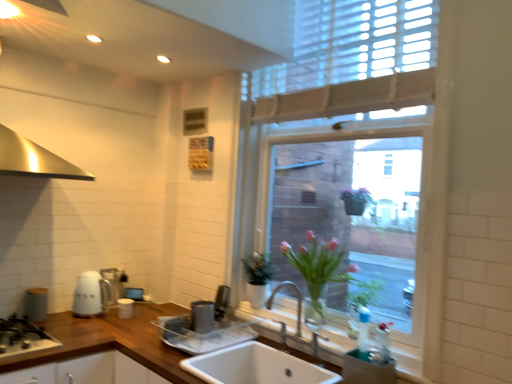
Describe the element at coordinates (256, 366) in the screenshot. I see `white ceramic sink at center` at that location.

Measure the distance between point [222,363] and camera.

The depth of point [222,363] is 6.42 feet.

Describe the element at coordinates (36, 304) in the screenshot. I see `matte gray canister at left, the third appliance positioned from the back` at that location.

Measure the distance between point (42, 310) and camera.

Point (42, 310) and camera are 2.35 meters apart from each other.

Consider the image. What is the approximate width of white glossy kettle at lower left, the 4th appliance from the right?

white glossy kettle at lower left, the 4th appliance from the right, is 6.95 inches wide.

The width and height of the screenshot is (512, 384). Identify the location of pink glass vase at center. (318, 266).

You are a GUI agent. You are given a task and a screenshot of the screen. Output one action in this format:
    pyautogui.click(x=<x>, y=<y>)
    Task: Click on the white ceramic sink at center
    The height and width of the screenshot is (384, 512).
    Given the screenshot: What is the action you would take?
    pyautogui.click(x=256, y=366)

From a real-world perspective, is white ceramic sink at lower center physically located above or below metallic silver dish drainer at lower right, marked as the 5th appliance in a left-to-right arrangement?

white ceramic sink at lower center is below metallic silver dish drainer at lower right, marked as the 5th appliance in a left-to-right arrangement.

Considering the relative positions of white ceramic sink at lower center and metallic silver dish drainer at lower right, marked as the 5th appliance in a left-to-right arrangement, in the image provided, is white ceramic sink at lower center to the left of metallic silver dish drainer at lower right, marked as the 5th appliance in a left-to-right arrangement, from the viewer's perspective?

Yes.

Does point (414, 357) appear closer or farther from the camera than point (393, 372)?

Point (414, 357).

Is white ceramic sink at lower center facing away from metallic silver dish drainer at lower right, which is the first appliance in right-to-left order?

That's right, white ceramic sink at lower center is facing away from metallic silver dish drainer at lower right, which is the first appliance in right-to-left order.

Looking at this image, considering the relative sizes of satin silver toaster at lower center, arranged as the second appliance when viewed from the right, and pink glass vase at center in the image provided, is satin silver toaster at lower center, arranged as the second appliance when viewed from the right, smaller than pink glass vase at center?

Indeed, satin silver toaster at lower center, arranged as the second appliance when viewed from the right, has a smaller size compared to pink glass vase at center.

Can you confirm if satin silver toaster at lower center, placed as the fourth appliance when sorted from left to right, is shorter than pink glass vase at center?

Correct, satin silver toaster at lower center, placed as the fourth appliance when sorted from left to right, is not as tall as pink glass vase at center.

Considering the relative sizes of satin silver toaster at lower center, acting as the second appliance starting from the front, and pink glass vase at center in the image provided, is satin silver toaster at lower center, acting as the second appliance starting from the front, thinner than pink glass vase at center?

Indeed, satin silver toaster at lower center, acting as the second appliance starting from the front, has a lesser width compared to pink glass vase at center.

From the picture: Who is taller, white ceramic sink at center or white glossy kettle at lower left, the second appliance in the left-to-right sequence?

Standing taller between the two is white glossy kettle at lower left, the second appliance in the left-to-right sequence.

Considering the sizes of objects white ceramic sink at center and white glossy kettle at lower left, the second appliance in the left-to-right sequence, in the image provided, who is thinner, white ceramic sink at center or white glossy kettle at lower left, the second appliance in the left-to-right sequence,?

white glossy kettle at lower left, the second appliance in the left-to-right sequence.

From a real-world perspective, does white ceramic sink at center sit lower than white glossy kettle at lower left, the 4th appliance from the right?

Yes, from a real-world perspective, white ceramic sink at center is beneath white glossy kettle at lower left, the 4th appliance from the right.

Is white ceramic sink at center not inside white glossy kettle at lower left, which is the 4th appliance from front to back?

Yes.

Which is more to the right, matte gray canister at left, acting as the third appliance starting from the front, or white glossy kettle at lower left, the 2th appliance positioned from the back?

white glossy kettle at lower left, the 2th appliance positioned from the back.

Does point (31, 320) come behind point (99, 307)?

That is False.

Is matte gray canister at left, placed as the fifth appliance when sorted from right to left, aimed at white glossy kettle at lower left, the 2th appliance positioned from the back?

No, matte gray canister at left, placed as the fifth appliance when sorted from right to left, is not facing towards white glossy kettle at lower left, the 2th appliance positioned from the back.

Considering the sizes of matte gray canister at left, acting as the third appliance starting from the front, and white glossy kettle at lower left, the 4th appliance from the right, in the image, is matte gray canister at left, acting as the third appliance starting from the front, bigger or smaller than white glossy kettle at lower left, the 4th appliance from the right,?

Considering their sizes, matte gray canister at left, acting as the third appliance starting from the front, takes up less space than white glossy kettle at lower left, the 4th appliance from the right.

Is point (377, 359) positioned before point (204, 313)?

Yes, it is.

From the image's perspective, is metallic silver dish drainer at lower right, which is the 1th appliance in front-to-back order, over satin silver toaster at lower center, acting as the second appliance starting from the front?

No, from the image's perspective, metallic silver dish drainer at lower right, which is the 1th appliance in front-to-back order, is not above satin silver toaster at lower center, acting as the second appliance starting from the front.

From a real-world perspective, which object rests below the other?

metallic silver dish drainer at lower right, which is the first appliance in right-to-left order, is physically lower.

Would you consider metallic silver dish drainer at lower right, the 5th appliance when ordered from back to front, to be distant from satin silver toaster at lower center, acting as the 4th appliance starting from the back?

metallic silver dish drainer at lower right, the 5th appliance when ordered from back to front, is actually quite close to satin silver toaster at lower center, acting as the 4th appliance starting from the back.

Can we say white glossy mug at lower left, the 3th appliance viewed from the left, lies outside satin silver toaster at lower center, arranged as the second appliance when viewed from the right?

white glossy mug at lower left, the 3th appliance viewed from the left, is positioned outside satin silver toaster at lower center, arranged as the second appliance when viewed from the right.

Is white glossy mug at lower left, marked as the fifth appliance in a front-to-back arrangement, oriented towards satin silver toaster at lower center, acting as the second appliance starting from the front?

Yes, white glossy mug at lower left, marked as the fifth appliance in a front-to-back arrangement, is turned towards satin silver toaster at lower center, acting as the second appliance starting from the front.

Is white glossy mug at lower left, marked as the fifth appliance in a front-to-back arrangement, touching satin silver toaster at lower center, placed as the fourth appliance when sorted from left to right?

No, white glossy mug at lower left, marked as the fifth appliance in a front-to-back arrangement, is not beside satin silver toaster at lower center, placed as the fourth appliance when sorted from left to right.

Is the depth of white glossy mug at lower left, the third appliance when ordered from right to left, less than that of satin silver toaster at lower center, arranged as the second appliance when viewed from the right?

No, white glossy mug at lower left, the third appliance when ordered from right to left, is behind satin silver toaster at lower center, arranged as the second appliance when viewed from the right.

Is white glossy mug at lower left, marked as the fifth appliance in a front-to-back arrangement, thinner than wooden at center?

Indeed, white glossy mug at lower left, marked as the fifth appliance in a front-to-back arrangement, has a lesser width compared to wooden at center.

Considering the sizes of objects white glossy mug at lower left, which appears as the 1th appliance when viewed from the back, and wooden at center in the image provided, who is taller, white glossy mug at lower left, which appears as the 1th appliance when viewed from the back, or wooden at center?

Standing taller between the two is wooden at center.

Image resolution: width=512 pixels, height=384 pixels. In order to click on countertop that is in front of the white glossy mug at lower left, the third appliance when ordered from right to left in this screenshot , I will do `click(111, 341)`.

Locate an element on the screen. This screenshot has height=384, width=512. appliance that is the 1st object located behind the white ceramic sink at lower center is located at coordinates 367,369.

At what (x,y) coordinates should I click in order to perform the action: click on the 1st appliance to the left of the pink glass vase at center, counting from the anchor's position. Please return your answer as a coordinate pair (x, y). This screenshot has height=384, width=512. Looking at the image, I should click on (202, 316).

From the picture: Considering their positions, is pink glass vase at center positioned closer to white ceramic sink at lower center than white ceramic sink at center?

Among the two, white ceramic sink at center is located nearer to white ceramic sink at lower center.

From the picture: From the image, which object appears to be nearer to metallic silver dish drainer at lower right, marked as the 5th appliance in a left-to-right arrangement, matte gray canister at left, acting as the third appliance starting from the front, or wooden at center?

The object closer to metallic silver dish drainer at lower right, marked as the 5th appliance in a left-to-right arrangement, is wooden at center.

Looking at the image, which one is located closer to white ceramic sink at center, white ceramic sink at lower center or metallic silver dish drainer at lower right, which is the first appliance in right-to-left order?

white ceramic sink at lower center lies closer to white ceramic sink at center than the other object.

From the picture: Looking at the image, which one is located closer to white ceramic sink at center, matte gray canister at left, the third appliance positioned from the back, or satin silver toaster at lower center, placed as the fourth appliance when sorted from left to right?

Based on the image, satin silver toaster at lower center, placed as the fourth appliance when sorted from left to right, appears to be nearer to white ceramic sink at center.

Estimate the real-world distances between objects in this image. Which object is closer to matte gray canister at left, which is the first appliance in left-to-right order, wooden at center or white glossy kettle at lower left, the 4th appliance from the right?

Based on the image, white glossy kettle at lower left, the 4th appliance from the right, appears to be nearer to matte gray canister at left, which is the first appliance in left-to-right order.

From the picture: Considering their positions, is wooden at center positioned closer to white ceramic sink at center than black matte gas stove at lower left?

Based on the image, wooden at center appears to be nearer to white ceramic sink at center.

Estimate the real-world distances between objects in this image. Which object is further from black matte gas stove at lower left, matte gray canister at left, placed as the fifth appliance when sorted from right to left, or white ceramic sink at center?

Among the two, white ceramic sink at center is located further to black matte gas stove at lower left.

Which object lies nearer to the anchor point pink glass vase at center, white glossy kettle at lower left, the 4th appliance from the right, or transparent glass window at center?

white glossy kettle at lower left, the 4th appliance from the right.

This screenshot has width=512, height=384. Identify the location of floral arrangement between white ceramic sink at center and metallic silver dish drainer at lower right, which is the first appliance in right-to-left order, in the horizontal direction. (318, 266).

Locate an element on the screen. The height and width of the screenshot is (384, 512). sink between wooden at center and pink glass vase at center in the horizontal direction is located at coordinates (256, 366).

Locate an element on the screen. The height and width of the screenshot is (384, 512). open located between white glossy kettle at lower left, the second appliance in the left-to-right sequence, and transparent glass window at center in the left-right direction is located at coordinates (256, 367).

At what (x,y) coordinates should I click in order to perform the action: click on appliance between white glossy mug at lower left, the 3th appliance viewed from the left, and transparent glass window at center, in the horizontal direction. Please return your answer as a coordinate pair (x, y). Looking at the image, I should click on (202, 316).